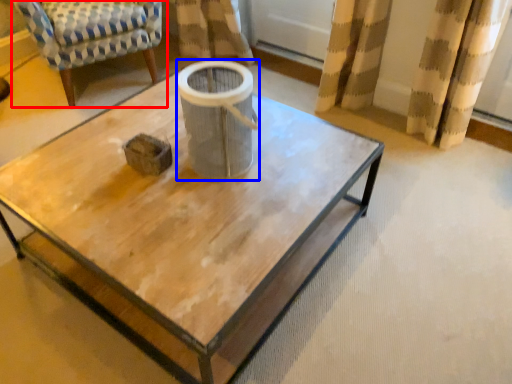
Question: Which of the following is the closest to the observer, chair (highlighted by a red box) or gray (highlighted by a blue box)?

Choices:
 (A) chair
 (B) gray

Answer: (B)